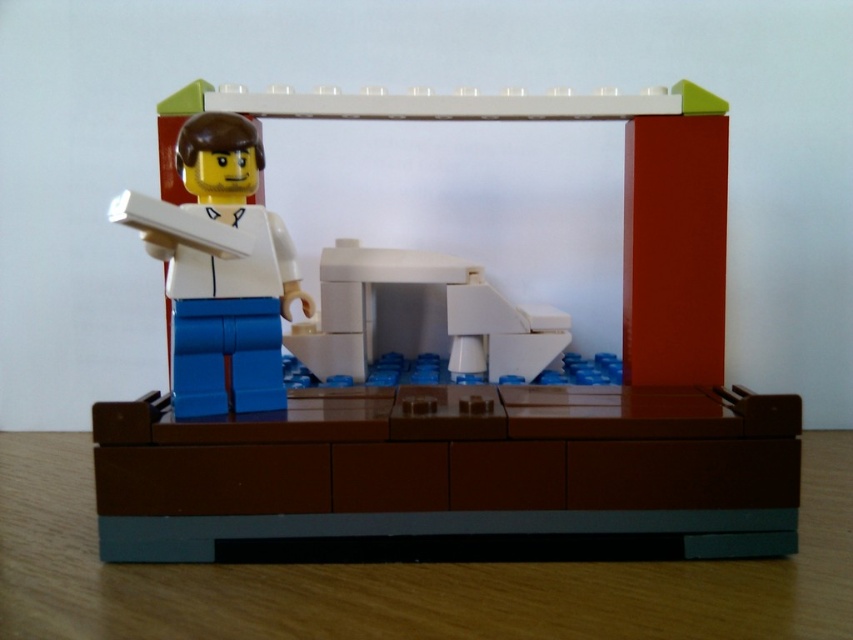
You are a LEGO figure standing at the point marked as point (236, 531). You want to reach the desk where the other LEGO figure is standing. The desk is 24 inches away from you. Can you reach the desk without moving more than 30 inches?

The distance between point (236, 531) and the viewer is 32.19 inches. Since the desk is 24 inches away, you can reach it without moving more than 30 inches because 24 inches is less than 30 inches.

You are a photographer trying to capture a photo of the LEGO scene. The camera is positioned at a standard angle. The point of focus is at point (730, 520). Given that the focus distance is set to 32.20 inches, will the LEGO figure on the desk be in focus?

The distance of point (730, 520) is 32.20 inches, so if the camera is focused at that point, the LEGO figure on the desk would be in focus if it is at the same distance. However, since the figure is on the desk in the foreground, it might be closer than the focus point, potentially causing it to be out of focus.